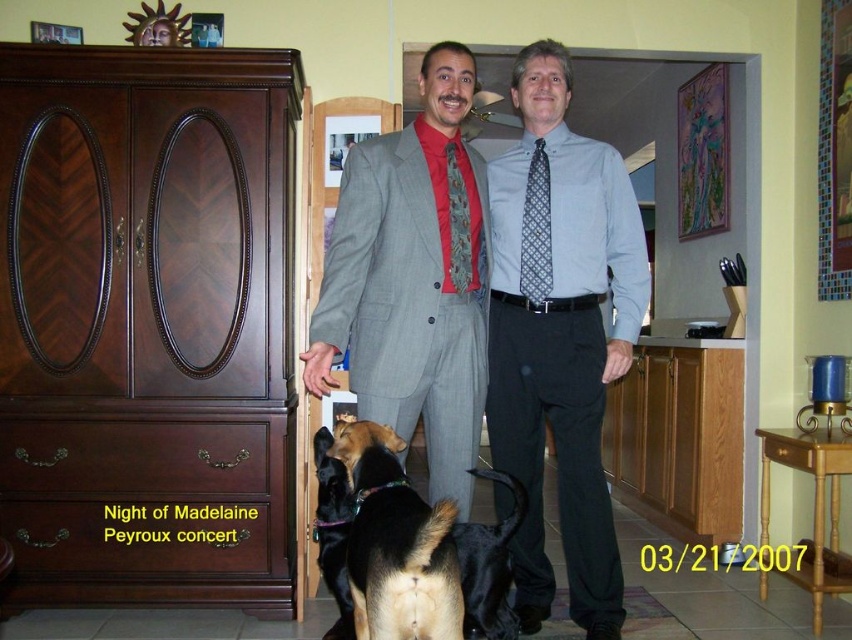
You are a photographer trying to capture a photo of both black fur dogs. You notice that the black fur dog at lower center and the black fur dog at center are positioned in a way that might block each other. Which dog is on the right side, so you can adjust your camera angle accordingly?

The black fur dog at lower center is positioned on the right side of the black fur dog at center, so you should adjust your camera angle to ensure both are visible without obstruction.

You are a photographer who needs to ensure that all subjects are visible in the photo. Given that the light blue shirt at center and the black fur dog at center are both in focus, which one should be positioned closer to the camera to maintain clarity?

The black fur dog at center should be positioned closer to the camera because the light blue shirt at center is larger in size, so placing the smaller black fur dog closer ensures both are in focus and visible.